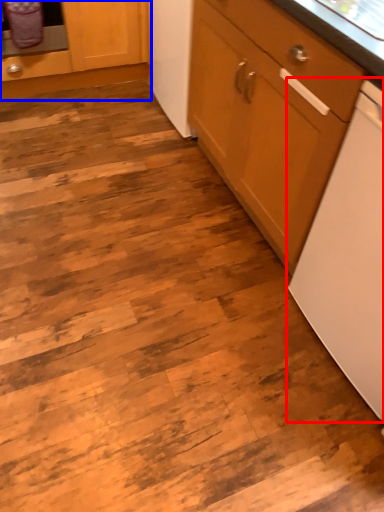
Question: Which of the following is the closest to the observer, home appliance (highlighted by a red box) or cabinetry (highlighted by a blue box)?

Choices:
 (A) home appliance
 (B) cabinetry

Answer: (A)